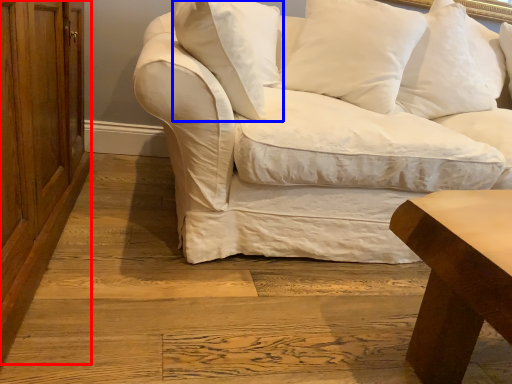
Question: Which point is closer to the camera, dresser (highlighted by a red box) or pillow (highlighted by a blue box)?

Choices:
 (A) dresser
 (B) pillow

Answer: (A)